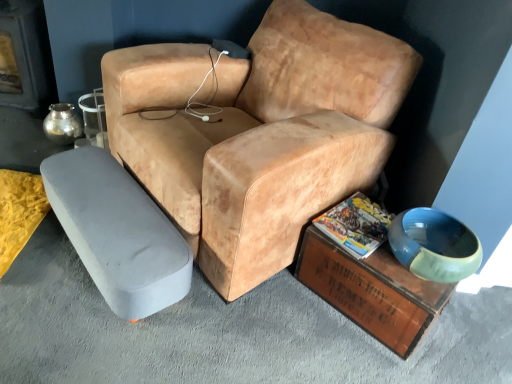
Locate an element on the screen. free space to the left of wooden crate at lower right, placed as the first table when sorted from right to left is located at coordinates (274, 317).